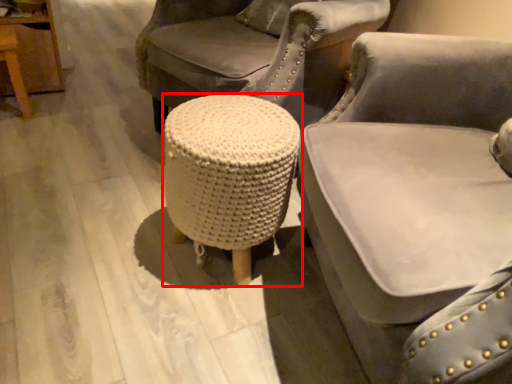
Question: From the image's perspective, what is the correct spatial relationship of stool (annotated by the red box) in relation to chair?

Choices:
 (A) above
 (B) below

Answer: (A)